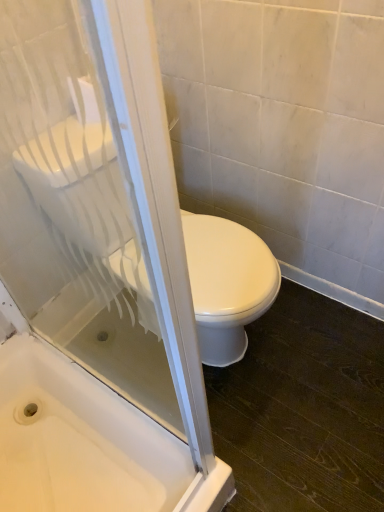
Question: Does white glossy bathtub at lower left appear on the left side of transparent glass screen door at upper left?

Choices:
 (A) yes
 (B) no

Answer: (A)

Question: Does white glossy bathtub at lower left lie in front of transparent glass screen door at upper left?

Choices:
 (A) yes
 (B) no

Answer: (B)

Question: Is white glossy bathtub at lower left outside of transparent glass screen door at upper left?

Choices:
 (A) no
 (B) yes

Answer: (B)

Question: Considering the relative sizes of white glossy bathtub at lower left and transparent glass screen door at upper left in the image provided, is white glossy bathtub at lower left wider than transparent glass screen door at upper left?

Choices:
 (A) no
 (B) yes

Answer: (B)

Question: Does white glossy bathtub at lower left have a lesser height compared to transparent glass screen door at upper left?

Choices:
 (A) yes
 (B) no

Answer: (A)

Question: Looking at the image, does white glossy toilet at center seem bigger or smaller compared to white glossy bathtub at lower left?

Choices:
 (A) small
 (B) big

Answer: (B)

Question: In terms of height, does white glossy toilet at center look taller or shorter compared to white glossy bathtub at lower left?

Choices:
 (A) short
 (B) tall

Answer: (B)

Question: Considering the relative positions of white glossy toilet at center and white glossy bathtub at lower left in the image provided, is white glossy toilet at center to the left or to the right of white glossy bathtub at lower left?

Choices:
 (A) left
 (B) right

Answer: (B)

Question: From the image's perspective, is white glossy toilet at center located above or below white glossy bathtub at lower left?

Choices:
 (A) above
 (B) below

Answer: (A)

Question: From a real-world perspective, relative to white glossy toilet at center, is transparent glass screen door at upper left vertically above or below?

Choices:
 (A) above
 (B) below

Answer: (A)

Question: Considering the positions of point (23, 350) and point (51, 130), is point (23, 350) closer or farther from the camera than point (51, 130)?

Choices:
 (A) farther
 (B) closer

Answer: (A)

Question: Relative to white glossy toilet at center, is transparent glass screen door at upper left in front or behind?

Choices:
 (A) front
 (B) behind

Answer: (A)

Question: In terms of height, does transparent glass screen door at upper left look taller or shorter compared to white glossy toilet at center?

Choices:
 (A) tall
 (B) short

Answer: (A)

Question: Considering the positions of white glossy bathtub at lower left and transparent glass screen door at upper left in the image, is white glossy bathtub at lower left wider or thinner than transparent glass screen door at upper left?

Choices:
 (A) wide
 (B) thin

Answer: (A)

Question: Is point (104, 410) closer or farther from the camera than point (153, 486)?

Choices:
 (A) farther
 (B) closer

Answer: (A)